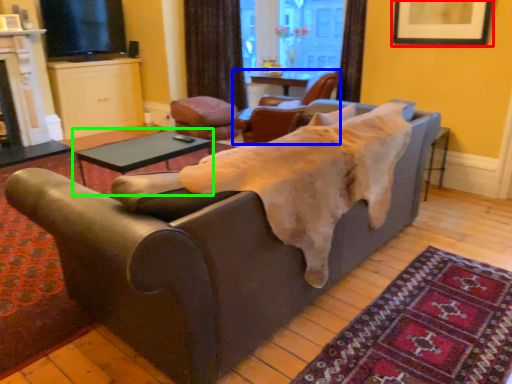
Question: Estimate the real-world distances between objects in this image. Which object is closer to picture frame (highlighted by a red box), chair (highlighted by a blue box) or table (highlighted by a green box)?

Choices:
 (A) chair
 (B) table

Answer: (A)